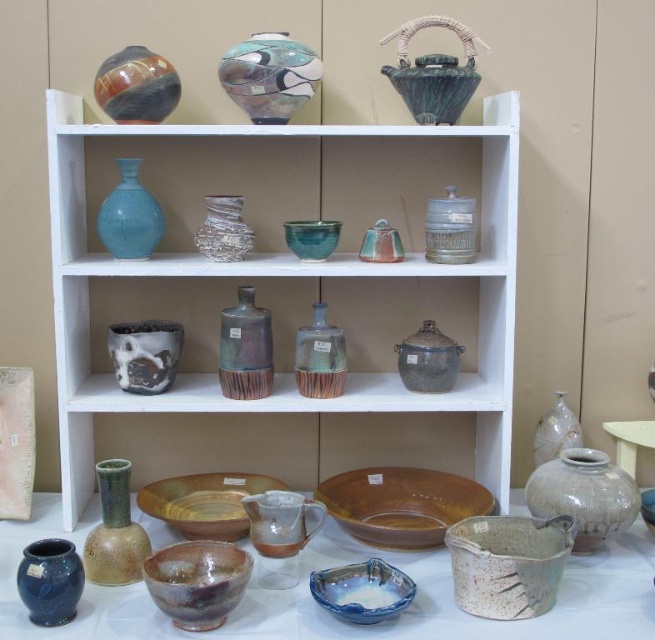
Is matte blue glass vase at upper left taller than matte brown pot at center?

Indeed, matte blue glass vase at upper left has a greater height compared to matte brown pot at center.

In the scene shown: Measure the distance between matte blue glass vase at upper left and matte brown pot at center.

matte blue glass vase at upper left is 23.82 inches away from matte brown pot at center.

Does point (136, 160) come farther from viewer compared to point (419, 330)?

No, it is in front of (419, 330).

Image resolution: width=655 pixels, height=640 pixels. What are the coordinates of `matte blue glass vase at upper left` in the screenshot? It's located at (128, 216).

Which is in front, point (434, 353) or point (310, 221)?

Point (310, 221) is in front.

Which is behind, point (428, 387) or point (305, 253)?

Positioned behind is point (428, 387).

The image size is (655, 640). Describe the element at coordinates (428, 358) in the screenshot. I see `matte brown pot at center` at that location.

This screenshot has height=640, width=655. In order to click on matte brown pot at center in this screenshot , I will do `click(428, 358)`.

Is point (576, 467) in front of point (631, 426)?

Yes, point (576, 467) is in front of point (631, 426).

Can you confirm if speckled clay jar at lower right is thinner than white glossy table at lower right?

No, speckled clay jar at lower right is not thinner than white glossy table at lower right.

Who is more distant from viewer, (550, 509) or (652, 433)?

The point (652, 433) is more distant.

The image size is (655, 640). Find the location of `speckled clay jar at lower right`. speckled clay jar at lower right is located at coordinates (584, 496).